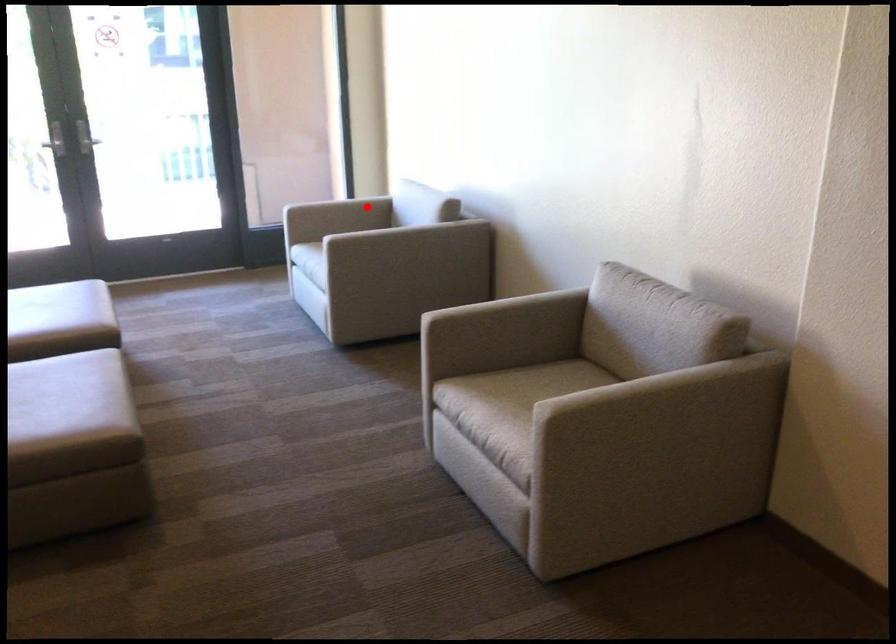
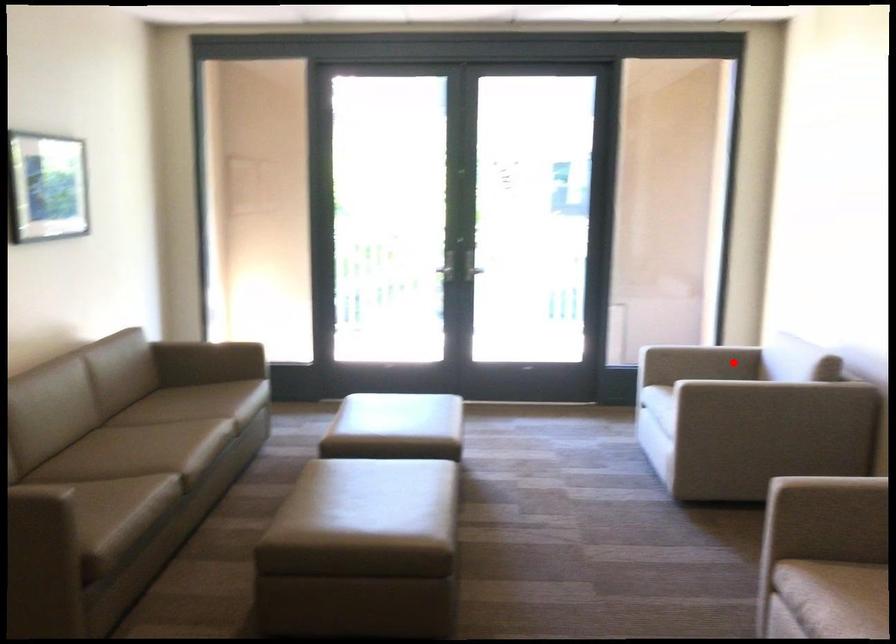
I am providing you with two images of the same scene from different viewpoints. A red point is marked on the first image and another point is marked on the second image. Is the red point in image1 aligned with the point shown in image2?

Yes